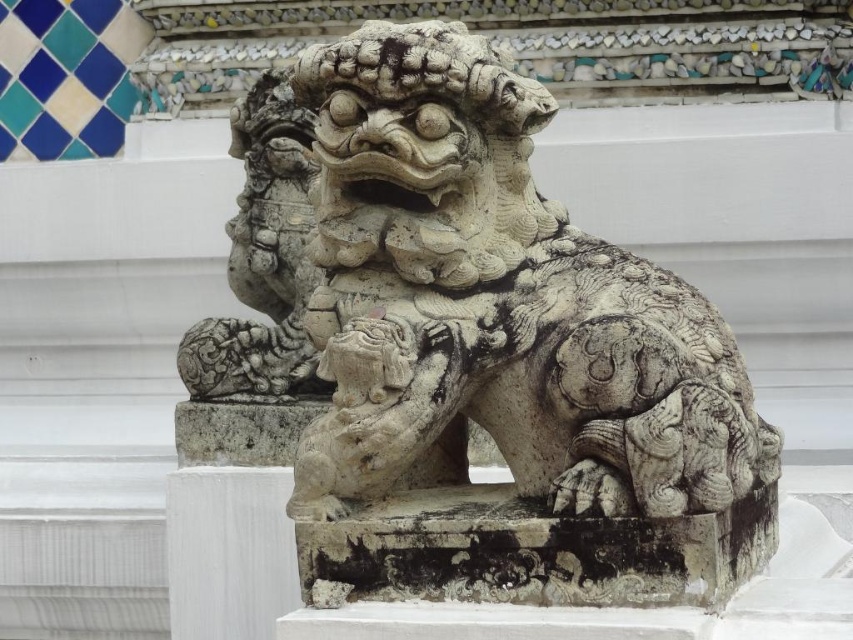
You are an art student analyzing the stone sculpture. You notice a specific point at coordinates point (468, 349). What object is located at that point?

The white stone lion at center is located at point (468, 349).

You are a delivery person trying to place a small package between the white stone lion at center and the white marble pillar at center. The package is 50 centimeters long. Will it fit in the space between them?

The white stone lion at center and white marble pillar at center are 58.84 centimeters apart, so the 50 centimeter package will fit between them since the space is wider than the package.

You are standing in front of the stone sculpture and notice two points marked on it. From your perspective, which point is closer to you, point (723, 518) or point (245, 481)?

Point (723, 518) is in front of point (245, 481), so it is closer to you.